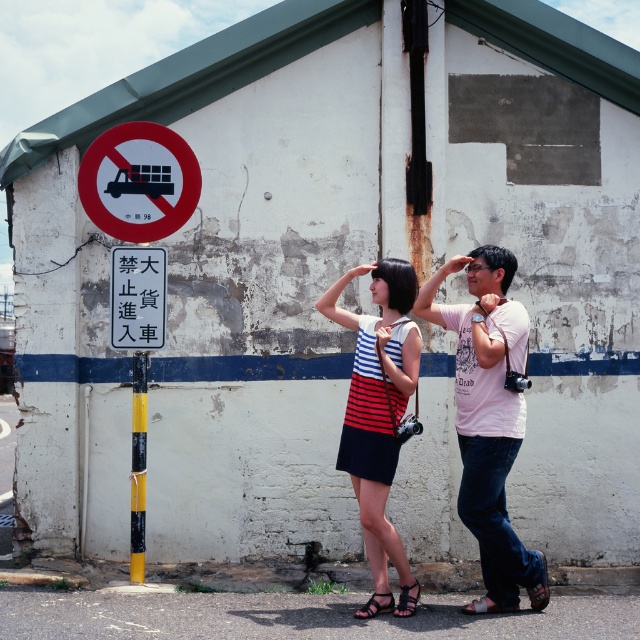
Does striped cotton dress at center appear under red circle sign at upper left?

Indeed, striped cotton dress at center is positioned under red circle sign at upper left.

Can you confirm if striped cotton dress at center is positioned to the right of red circle sign at upper left?

Yes, striped cotton dress at center is to the right of red circle sign at upper left.

The height and width of the screenshot is (640, 640). What are the coordinates of `striped cotton dress at center` in the screenshot? It's located at (378, 417).

Can you confirm if striped cotton dress at center is wider than white plastic sign at center?

Yes, striped cotton dress at center is wider than white plastic sign at center.

Can you confirm if striped cotton dress at center is smaller than white plastic sign at center?

Actually, striped cotton dress at center might be larger than white plastic sign at center.

What do you see at coordinates (378, 417) in the screenshot? I see `striped cotton dress at center` at bounding box center [378, 417].

In order to click on striped cotton dress at center in this screenshot , I will do `click(378, 417)`.

Does striped cotton dress at center have a greater width compared to yellow painted pole at lower center?

Yes.

Which is more to the left, striped cotton dress at center or yellow painted pole at lower center?

From the viewer's perspective, yellow painted pole at lower center appears more on the left side.

The width and height of the screenshot is (640, 640). Find the location of `striped cotton dress at center`. striped cotton dress at center is located at coordinates (378, 417).